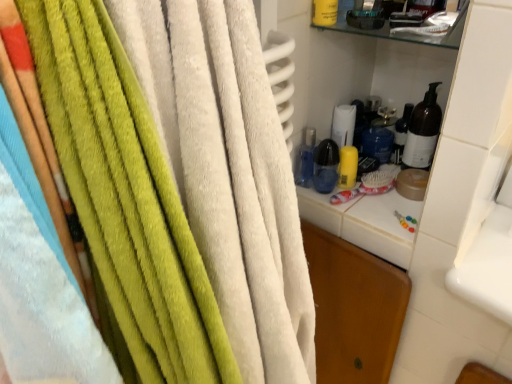
Locate an element on the screen. Image resolution: width=512 pixels, height=384 pixels. soft green towel at left is located at coordinates (229, 171).

Measure the distance between point [254,220] and camera.

Point [254,220] is 19.45 inches away from camera.

Describe the element at coordinates (229, 171) in the screenshot. I see `soft green towel at left` at that location.

Describe the element at coordinates (306, 158) in the screenshot. I see `transparent plastic bottle at center` at that location.

Where is `transparent plastic bottle at center`? The height and width of the screenshot is (384, 512). transparent plastic bottle at center is located at coordinates (306, 158).

Find the location of a particular element. The height and width of the screenshot is (384, 512). soft green towel at left is located at coordinates (229, 171).

Based on their positions, is soft green towel at left located to the left or right of transparent plastic bottle at center?

soft green towel at left is to the left of transparent plastic bottle at center.

Which object is further away from the camera, soft green towel at left or transparent plastic bottle at center?

transparent plastic bottle at center is further from the camera.

Between point (193, 37) and point (314, 129), which one is positioned behind?

The point (314, 129) is behind.

From the image's perspective, between soft green towel at left and transparent plastic bottle at center, which one is located above?

transparent plastic bottle at center is shown above in the image.

Consider the image. From a real-world perspective, who is located lower, soft green towel at left or transparent plastic bottle at center?

From a 3D spatial view, transparent plastic bottle at center is below.

Which of these two, soft green towel at left or transparent plastic bottle at center, is wider?

With larger width is soft green towel at left.

Who is shorter, soft green towel at left or transparent plastic bottle at center?

transparent plastic bottle at center.

Between soft green towel at left and transparent plastic bottle at center, which one has larger size?

soft green towel at left is bigger.

Is soft green towel at left not within transparent plastic bottle at center?

Yes.

Does soft green towel at left touch transparent plastic bottle at center?

There is a gap between soft green towel at left and transparent plastic bottle at center.

Could you tell me if soft green towel at left is turned towards transparent plastic bottle at center?

No, soft green towel at left does not turn towards transparent plastic bottle at center.

How different are the orientations of soft green towel at left and transparent plastic bottle at center in degrees?

88.7 degrees separate the facing orientations of soft green towel at left and transparent plastic bottle at center.

How distant is soft green towel at left from transparent plastic bottle at center?

They are 20.51 inches apart.

Find the location of a particular element. The height and width of the screenshot is (384, 512). towel below the transparent plastic bottle at center (from the image's perspective) is located at coordinates (229, 171).

Between transparent plastic bottle at center and soft green towel at left, which one appears on the left side from the viewer's perspective?

Positioned to the left is soft green towel at left.

In the image, is transparent plastic bottle at center positioned in front of or behind soft green towel at left?

transparent plastic bottle at center is positioned farther from the viewer than soft green towel at left.

Does point (297, 179) come farther from viewer compared to point (297, 353)?

That is True.

From the image's perspective, is transparent plastic bottle at center positioned above or below soft green towel at left?

transparent plastic bottle at center is above soft green towel at left.

Consider the image. From a real-world perspective, between transparent plastic bottle at center and soft green towel at left, who is vertically lower?

transparent plastic bottle at center is physically lower.

Is transparent plastic bottle at center wider than soft green towel at left?

Incorrect, the width of transparent plastic bottle at center does not surpass that of soft green towel at left.

Can you confirm if transparent plastic bottle at center is shorter than soft green towel at left?

Yes.

Between transparent plastic bottle at center and soft green towel at left, which one has larger size?

soft green towel at left.

Is transparent plastic bottle at center not inside soft green towel at left?

transparent plastic bottle at center lies outside soft green towel at left's area.

Are transparent plastic bottle at center and soft green towel at left located far from each other?

transparent plastic bottle at center is near soft green towel at left, not far away.

Is transparent plastic bottle at center oriented away from soft green towel at left?

transparent plastic bottle at center is not turned away from soft green towel at left.

Measure the distance between transparent plastic bottle at center and soft green towel at left.

The distance of transparent plastic bottle at center from soft green towel at left is 20.51 inches.

In the image, there is a soft green towel at left. At what (x,y) coordinates should I click in order to perform the action: click on bottle above it (from the image's perspective). Please return your answer as a coordinate pair (x, y). This screenshot has width=512, height=384. Looking at the image, I should click on (306, 158).

Where is `towel in front of the transparent plastic bottle at center`? The height and width of the screenshot is (384, 512). towel in front of the transparent plastic bottle at center is located at coordinates (229, 171).

I want to click on towel that is above the transparent plastic bottle at center (from a real-world perspective), so click(229, 171).